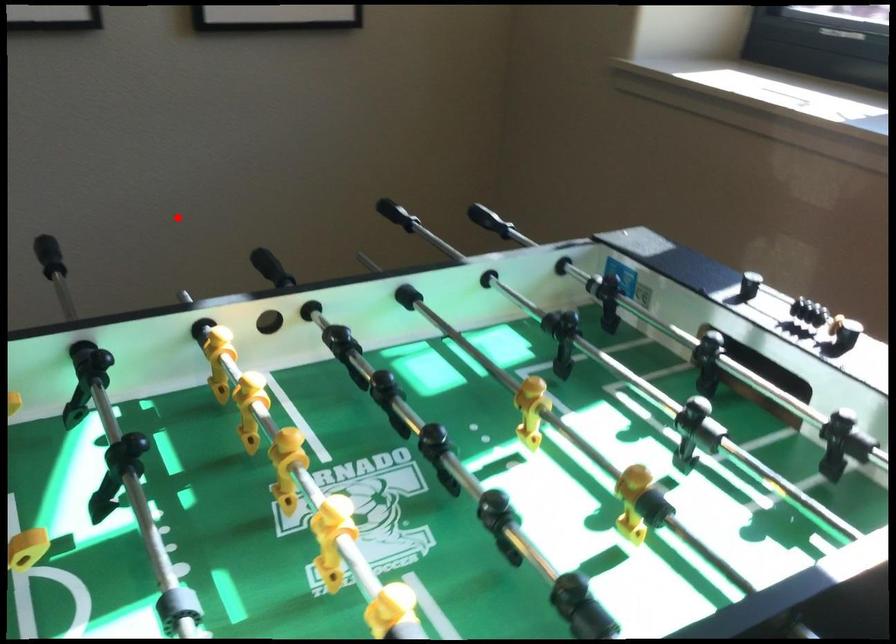
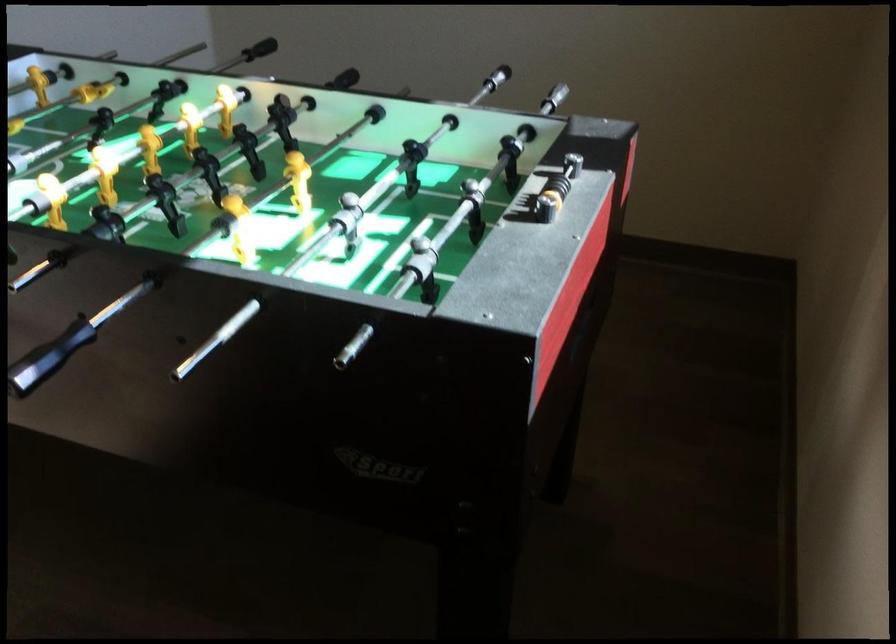
Question: A red point is marked in image1. In image2, is the corresponding 3D point closer to the camera or farther? Reply with the corresponding letter.

Choices:
 (A) The corresponding 3D point is closer.
 (B) The corresponding 3D point is farther.

Answer: (B)